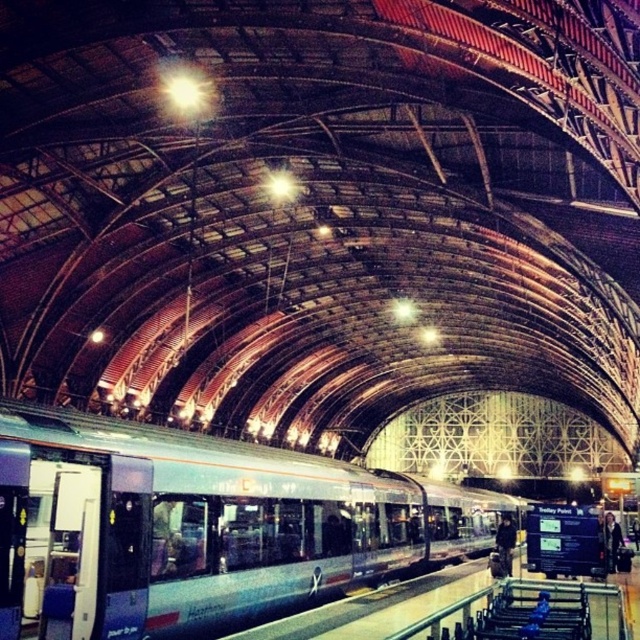
Consider the image. You are a photographer standing in the center of the station. You want to capture a photo of both the dark hair at platform right and the dark brown leather jacket at center in the same frame. Given their sizes, which object will appear smaller in the photo?

The dark hair at platform right will appear smaller in the photo because its width is less than the dark brown leather jacket at center.

You are a passenger waiting at the platform and want to board the silver metallic train at center. There is a person with dark hair at platform right blocking your path. Can you easily walk around them to reach the train?

The silver metallic train at center is much larger than the dark hair at platform right, so you can easily walk around the person with dark hair at platform right to reach the train since the train is significantly bigger.

You are standing in the grand railway station and want to take a photo of the silver metallic train at center. Where should you position yourself to capture it in the frame?

To capture the silver metallic train at center in your photo, position yourself at the center of the station, as the train is located at point (200,525) which is near the center area.